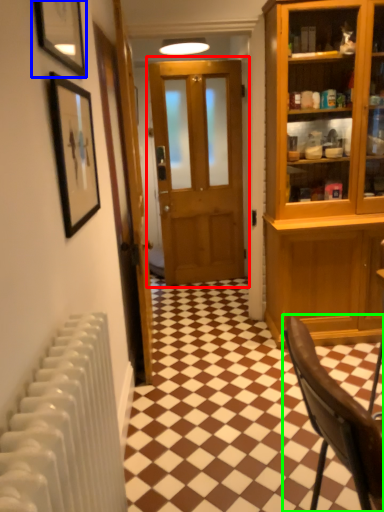
Question: Based on their relative distances, which object is farther from door (highlighted by a red box)? Choose from picture frame (highlighted by a blue box) and chair (highlighted by a green box).

Choices:
 (A) picture frame
 (B) chair

Answer: (B)